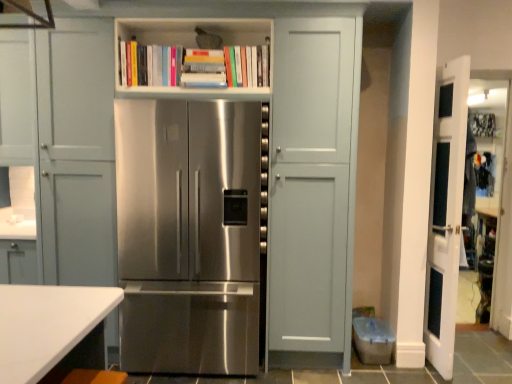
Question: Can you confirm if white matte bookshelf at upper center is taller than stainless steel refrigerator at center?

Choices:
 (A) no
 (B) yes

Answer: (A)

Question: From the image's perspective, is white matte bookshelf at upper center located beneath stainless steel refrigerator at center?

Choices:
 (A) yes
 (B) no

Answer: (B)

Question: Can stainless steel refrigerator at center be found inside white matte bookshelf at upper center?

Choices:
 (A) no
 (B) yes

Answer: (A)

Question: Considering the relative sizes of white matte bookshelf at upper center and stainless steel refrigerator at center in the image provided, is white matte bookshelf at upper center bigger than stainless steel refrigerator at center?

Choices:
 (A) yes
 (B) no

Answer: (B)

Question: Can you confirm if white matte bookshelf at upper center is positioned to the left of stainless steel refrigerator at center?

Choices:
 (A) yes
 (B) no

Answer: (B)

Question: Is white glossy door at right wider or thinner than stainless steel refrigerator at center?

Choices:
 (A) thin
 (B) wide

Answer: (A)

Question: From the image's perspective, is white glossy door at right above or below stainless steel refrigerator at center?

Choices:
 (A) above
 (B) below

Answer: (A)

Question: Is white glossy door at right bigger or smaller than stainless steel refrigerator at center?

Choices:
 (A) big
 (B) small

Answer: (B)

Question: From their relative heights in the image, would you say white glossy door at right is taller or shorter than stainless steel refrigerator at center?

Choices:
 (A) short
 (B) tall

Answer: (B)

Question: Considering the positions of point (170, 92) and point (157, 324), is point (170, 92) closer or farther from the camera than point (157, 324)?

Choices:
 (A) farther
 (B) closer

Answer: (B)

Question: In terms of size, does white matte bookshelf at upper center appear bigger or smaller than stainless steel refrigerator at center?

Choices:
 (A) small
 (B) big

Answer: (A)

Question: Choose the correct answer: Is white matte bookshelf at upper center inside stainless steel refrigerator at center or outside it?

Choices:
 (A) outside
 (B) inside

Answer: (A)

Question: Considering the positions of white matte bookshelf at upper center and stainless steel refrigerator at center in the image, is white matte bookshelf at upper center taller or shorter than stainless steel refrigerator at center?

Choices:
 (A) short
 (B) tall

Answer: (A)

Question: From the image's perspective, is stainless steel refrigerator at center positioned above or below white matte bookshelf at upper center?

Choices:
 (A) below
 (B) above

Answer: (A)

Question: Looking at the image, does stainless steel refrigerator at center seem bigger or smaller compared to white matte bookshelf at upper center?

Choices:
 (A) small
 (B) big

Answer: (B)